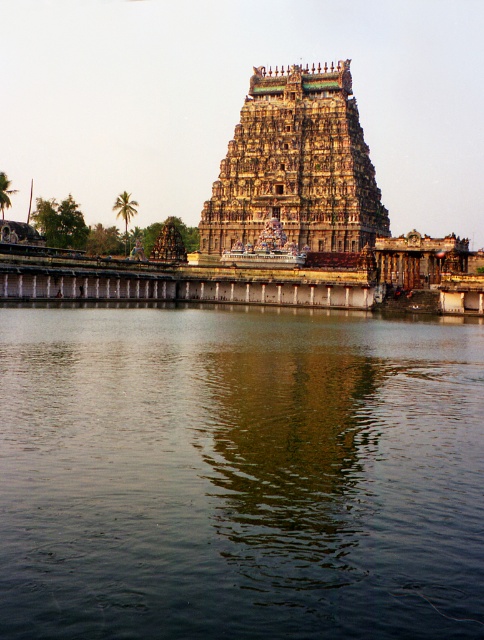
Question: In this image, where is green reflective water at center located relative to carved stone temple at center?

Choices:
 (A) right
 (B) left

Answer: (B)

Question: Does green reflective water at center come in front of carved stone temple at center?

Choices:
 (A) yes
 (B) no

Answer: (A)

Question: Does green reflective water at center have a greater width compared to carved stone temple at center?

Choices:
 (A) no
 (B) yes

Answer: (B)

Question: Which point is farther to the camera?

Choices:
 (A) (258, 100)
 (B) (107, 540)

Answer: (A)